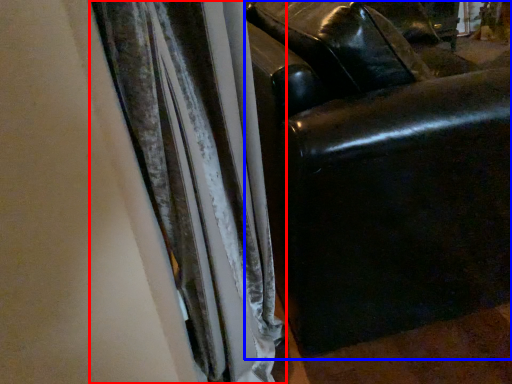
Question: Which object appears closest to the camera in this image, curtain (highlighted by a red box) or furniture (highlighted by a blue box)?

Choices:
 (A) curtain
 (B) furniture

Answer: (A)